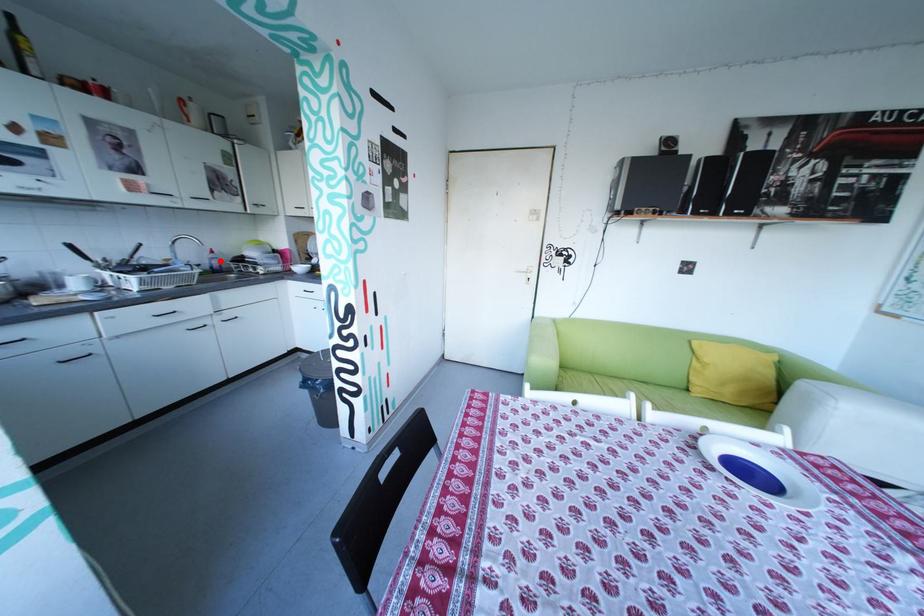
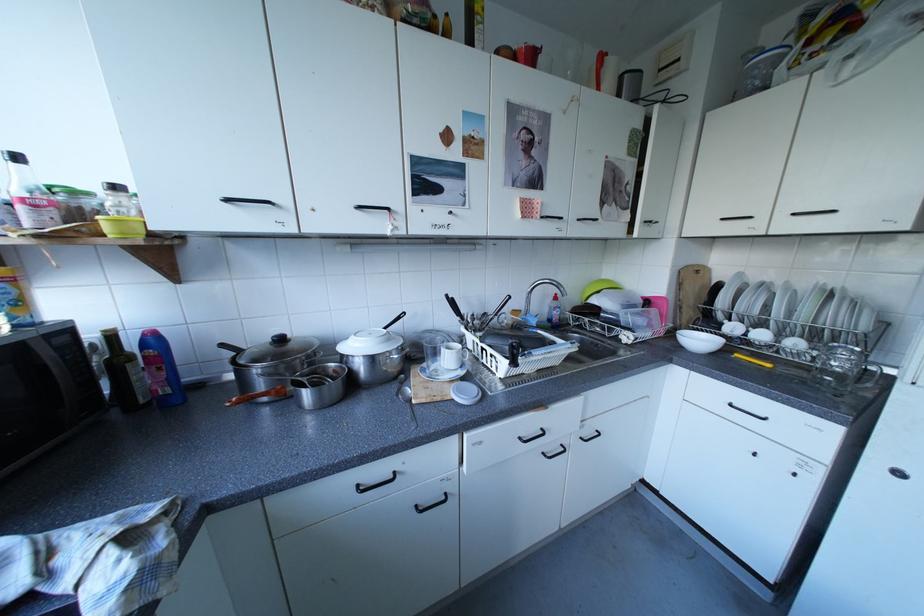
Where in the second image is the point corresponding to the highlighted location from the first image?

(558, 310)